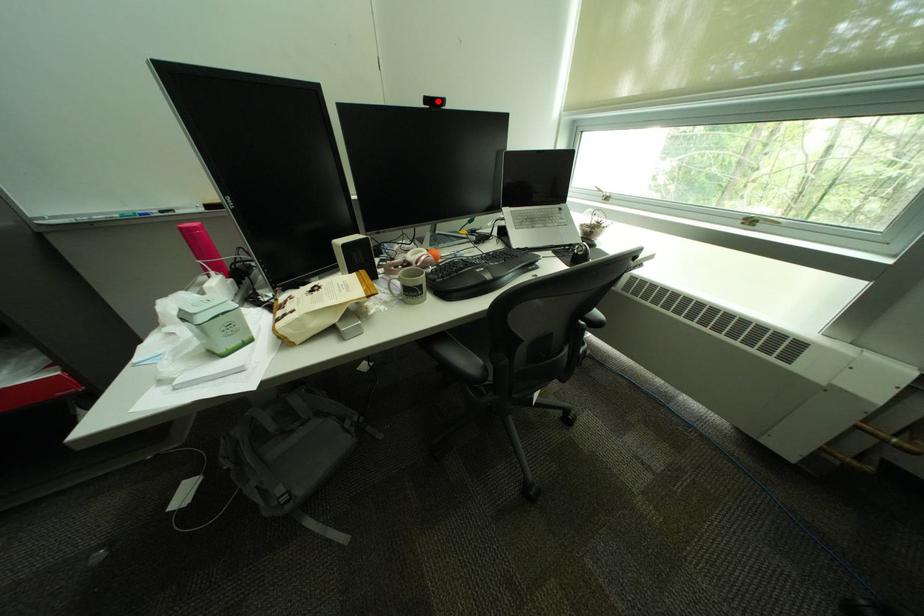
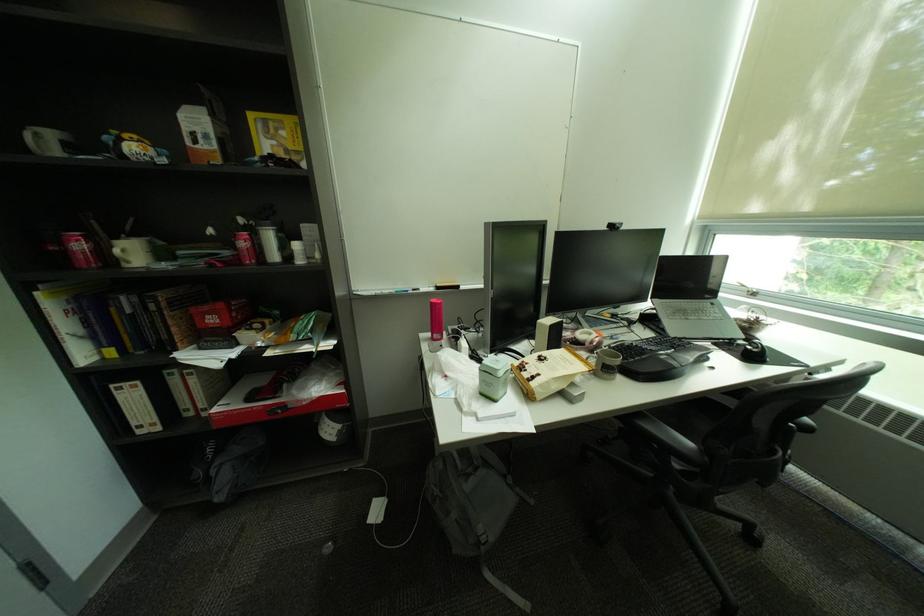
Locate, in the second image, the point that corresponds to the highlighted location in the first image.

(621, 227)